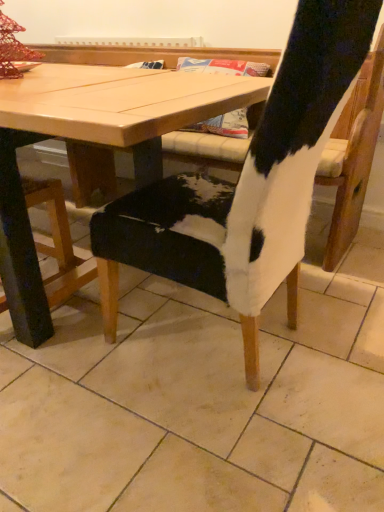
Question: From the image's perspective, is cowhide chair at center positioned above or below wooden table at center?

Choices:
 (A) below
 (B) above

Answer: (A)

Question: Is cowhide chair at center inside the boundaries of wooden table at center, or outside?

Choices:
 (A) inside
 (B) outside

Answer: (B)

Question: Which of these objects is positioned closest to the cowhide chair at center?

Choices:
 (A) cowhide chair at center
 (B) wooden table at center

Answer: (A)

Question: Estimate the real-world distances between objects in this image. Which object is closer to the wooden table at center?

Choices:
 (A) cowhide chair at center
 (B) cowhide chair at center

Answer: (B)